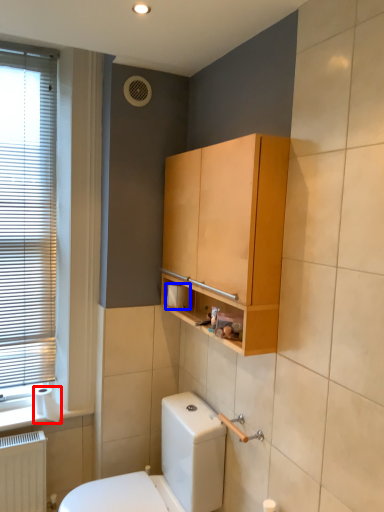
Question: Which object appears farthest to the camera in this image, toilet paper (highlighted by a red box) or toilet paper (highlighted by a blue box)?

Choices:
 (A) toilet paper
 (B) toilet paper

Answer: (A)